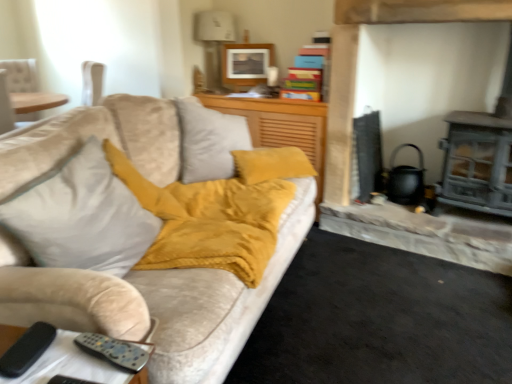
What is the approximate height of velvet yellow throw pillow at center?

18.17 inches.

What do you see at coordinates (280, 125) in the screenshot?
I see `suede-like mustard yellow cushion at center` at bounding box center [280, 125].

The width and height of the screenshot is (512, 384). What do you see at coordinates (351, 139) in the screenshot? I see `matte gray fireplace at right` at bounding box center [351, 139].

In order to face matte gray fireplace at right, should I rotate leftwards or rightwards?

To face it directly, rotate right by 21.219 degrees.

What are the coordinates of `matte wooden picture frame at upper center` in the screenshot? It's located at 246,64.

The width and height of the screenshot is (512, 384). I want to click on velvet yellow throw pillow at center, so click(x=81, y=216).

In the image, is metallic silver remote control at lower left on the left side or the right side of matte wooden picture frame at upper center?

From the image, it's evident that metallic silver remote control at lower left is to the left of matte wooden picture frame at upper center.

From the image's perspective, which is above, metallic silver remote control at lower left or matte wooden picture frame at upper center?

matte wooden picture frame at upper center is shown above in the image.

From a real-world perspective, which object rests below the other?

In real-world perspective, metallic silver remote control at lower left is lower.

Is matte gray fireplace at right smaller than velvet yellow throw pillow at center?

No.

Does matte gray fireplace at right appear on the right side of velvet yellow throw pillow at center?

Indeed, matte gray fireplace at right is positioned on the right side of velvet yellow throw pillow at center.

From the image's perspective, is matte gray fireplace at right located beneath velvet yellow throw pillow at center?

No, from the image's perspective, matte gray fireplace at right is not below velvet yellow throw pillow at center.

Would you say matte gray fireplace at right contains velvet yellow throw pillow at center?

Actually, velvet yellow throw pillow at center is outside matte gray fireplace at right.

Measure the distance between metallic silver remote control at lower left and velvet yellow throw pillow at center.

metallic silver remote control at lower left is 42.39 centimeters away from velvet yellow throw pillow at center.

You are a GUI agent. You are given a task and a screenshot of the screen. Output one action in this format:
    pyautogui.click(x=<x>, y=<y>)
    Task: Click on the throw pillow behind the metallic silver remote control at lower left
    The height and width of the screenshot is (384, 512).
    Given the screenshot: What is the action you would take?
    pyautogui.click(x=81, y=216)

Is point (85, 376) closer or farther from the camera than point (117, 274)?

Clearly, point (85, 376) is closer to the camera than point (117, 274).

From the image's perspective, would you say matte gray fireplace at right is shown under matte wooden picture frame at upper center?

Yes, from the image's perspective, matte gray fireplace at right is below matte wooden picture frame at upper center.

From a real-world perspective, does matte gray fireplace at right stand above matte wooden picture frame at upper center?

Actually, matte gray fireplace at right is physically below matte wooden picture frame at upper center in the real world.

Looking at this image, is the surface of matte gray fireplace at right in direct contact with matte wooden picture frame at upper center?

They are not placed beside each other.

Measure the distance from matte gray fireplace at right to matte wooden picture frame at upper center.

matte gray fireplace at right is 37.10 inches away from matte wooden picture frame at upper center.

From the image's perspective, which is above, metallic silver remote control at lower left or matte gray fireplace at right?

matte gray fireplace at right, from the image's perspective.

Does metallic silver remote control at lower left have a lesser height compared to matte gray fireplace at right?

Yes, metallic silver remote control at lower left is shorter than matte gray fireplace at right.

Image resolution: width=512 pixels, height=384 pixels. I want to click on table directly beneath the matte gray fireplace at right (from a real-world perspective), so click(x=69, y=365).

Does matte wooden picture frame at upper center have a greater width compared to metallic silver remote control at lower left?

Incorrect, the width of matte wooden picture frame at upper center does not surpass that of metallic silver remote control at lower left.

Looking at the image, does matte wooden picture frame at upper center seem bigger or smaller compared to metallic silver remote control at lower left?

matte wooden picture frame at upper center is bigger than metallic silver remote control at lower left.

Based on the photo, is metallic silver remote control at lower left located within matte wooden picture frame at upper center?

No.

In the scene shown: Is matte wooden picture frame at upper center aimed at metallic silver remote control at lower left?

Yes, matte wooden picture frame at upper center is facing metallic silver remote control at lower left.

Can you confirm if matte gray fireplace at right is taller than metallic silver remote control at lower left?

Yes.

Consider the image. Does matte gray fireplace at right come in front of metallic silver remote control at lower left?

That is False.

Is matte gray fireplace at right at the right side of metallic silver remote control at lower left?

Indeed, matte gray fireplace at right is positioned on the right side of metallic silver remote control at lower left.

The width and height of the screenshot is (512, 384). Find the location of `picture frame behind the metallic silver remote control at lower left`. picture frame behind the metallic silver remote control at lower left is located at coordinates (246, 64).

Identify the location of throw pillow that is on the left side of matte gray fireplace at right. (81, 216).

Considering their positions, is velvet yellow throw pillow at center positioned further to matte gray fireplace at right than matte wooden picture frame at upper center?

Among the two, velvet yellow throw pillow at center is located further to matte gray fireplace at right.

Looking at the image, which one is located further to matte wooden picture frame at upper center, matte gray fireplace at right or suede-like mustard yellow cushion at center?

Based on the image, matte gray fireplace at right appears to be further to matte wooden picture frame at upper center.

Which object lies further to the anchor point matte gray fireplace at right, suede-like mustard yellow cushion at center or velvet yellow throw pillow at center?

The object further to matte gray fireplace at right is velvet yellow throw pillow at center.

From the image, which object appears to be farther from velvet yellow throw pillow at center, suede-like mustard yellow cushion at center or matte wooden picture frame at upper center?

matte wooden picture frame at upper center.

Looking at the image, which one is located further to metallic silver remote control at lower left, matte gray fireplace at right or matte wooden picture frame at upper center?

matte wooden picture frame at upper center.

Considering their positions, is suede-like mustard yellow cushion at center positioned closer to velvet yellow throw pillow at center than matte gray fireplace at right?

Based on the image, suede-like mustard yellow cushion at center appears to be nearer to velvet yellow throw pillow at center.

Estimate the real-world distances between objects in this image. Which object is further from matte wooden picture frame at upper center, metallic silver remote control at lower left or suede-like mustard yellow cushion at center?

metallic silver remote control at lower left lies further to matte wooden picture frame at upper center than the other object.

From the image, which object appears to be nearer to matte gray fireplace at right, suede-like mustard yellow cushion at center or matte wooden picture frame at upper center?

The object closer to matte gray fireplace at right is suede-like mustard yellow cushion at center.

The height and width of the screenshot is (384, 512). I want to click on fireplace positioned between metallic silver remote control at lower left and matte wooden picture frame at upper center from near to far, so click(x=351, y=139).

Where is `table situated between velvet yellow throw pillow at center and matte gray fireplace at right from left to right`? Image resolution: width=512 pixels, height=384 pixels. table situated between velvet yellow throw pillow at center and matte gray fireplace at right from left to right is located at coordinates (69, 365).

The image size is (512, 384). I want to click on dresser positioned between matte gray fireplace at right and matte wooden picture frame at upper center from near to far, so click(x=280, y=125).

Where is `fireplace between velvet yellow throw pillow at center and matte wooden picture frame at upper center in the front-back direction`? This screenshot has width=512, height=384. fireplace between velvet yellow throw pillow at center and matte wooden picture frame at upper center in the front-back direction is located at coordinates (351, 139).